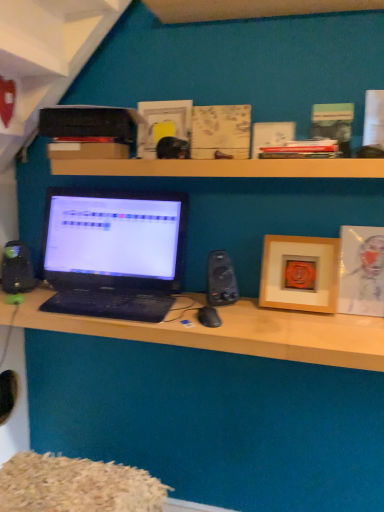
Locate an element on the screen. empty space that is to the right of black matte mouse at center is located at coordinates (253, 333).